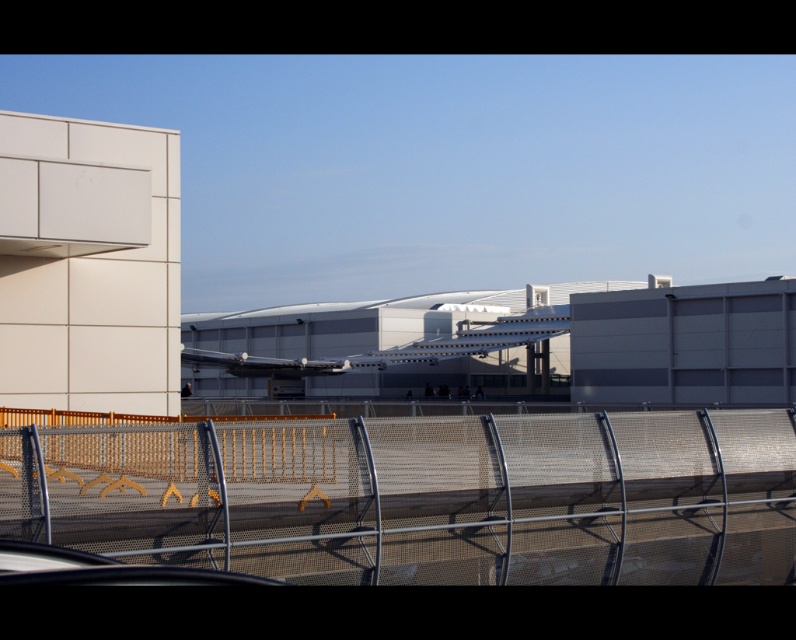
You are standing in front of the metal mesh fence at center and the white metallic airliner at center. Which object is closer to you?

The metal mesh fence at center is closer to you because it is in front of the white metallic airliner at center.

You are a delivery drone operator. Your drone has a wingspan of 1.2 meters. You need to fly it through the gap between the metal mesh fence at center and the white metallic airliner at center. Can your drone safely pass through the gap without touching either object?

The metal mesh fence at center has a lesser width compared to the white metallic airliner at center. Since the fence is narrower than the airliner, the gap between them is likely sufficient for the drone with a 1.2 meter wingspan to pass safely without touching either object.

You are standing at point (422, 497) in the scene. What object are you standing on?

You are standing on the metal mesh fence at center located at point (422, 497).